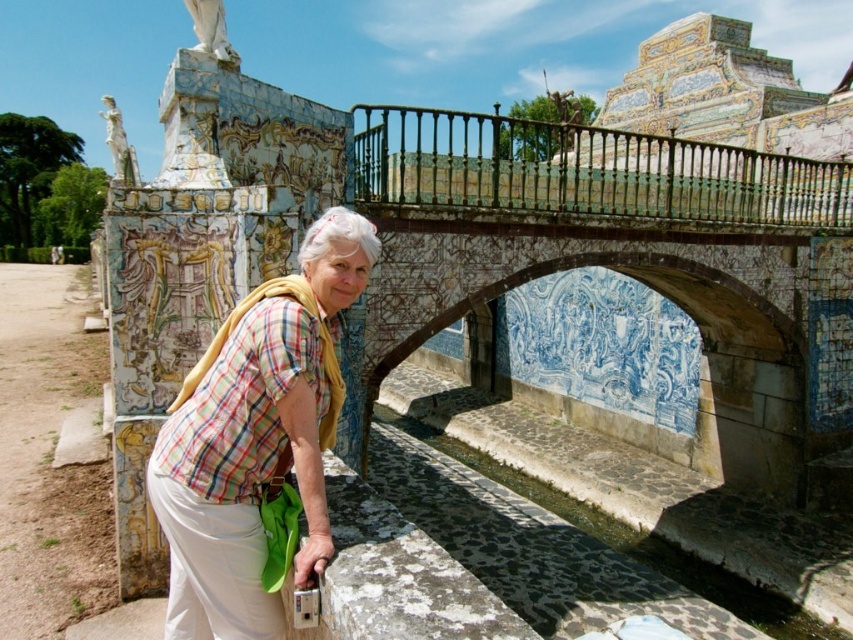
Which of these two, white marble statue at upper center or white marble statue at upper left, stands shorter?

Result: Standing shorter between the two is white marble statue at upper center.

Can you confirm if white marble statue at upper center is thinner than white marble statue at upper left?

Indeed, white marble statue at upper center has a lesser width compared to white marble statue at upper left.

Is point (204, 42) behind point (132, 164)?

No, it is not.

In order to click on white marble statue at upper center in this screenshot , I will do `click(212, 29)`.

Does plaid shirt at center have a smaller size compared to white marble statue at upper left?

Correct, plaid shirt at center occupies less space than white marble statue at upper left.

Is plaid shirt at center positioned in front of white marble statue at upper left?

Yes, it is in front of white marble statue at upper left.

The image size is (853, 640). I want to click on plaid shirt at center, so (x=256, y=436).

Who is more forward, (253, 360) or (160, 486)?

Point (160, 486) is in front.

This screenshot has width=853, height=640. Describe the element at coordinates (242, 404) in the screenshot. I see `plaid fabric at center` at that location.

Is point (245, 372) closer to viewer compared to point (251, 588)?

No, it is behind (251, 588).

This screenshot has height=640, width=853. What are the coordinates of `plaid fabric at center` in the screenshot? It's located at (242, 404).